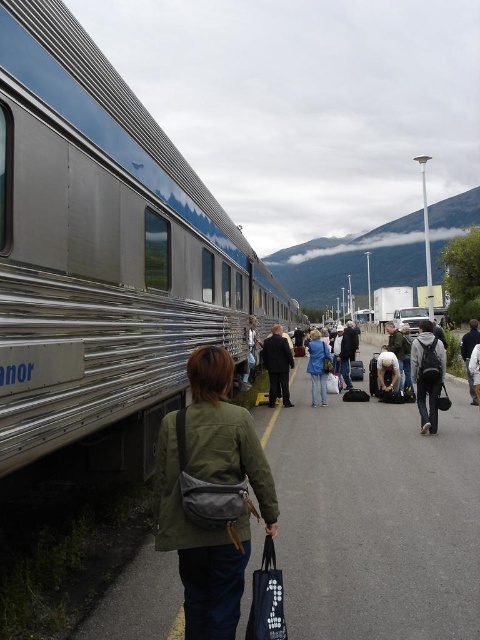
Question: Which point is closer to the camera?

Choices:
 (A) (224, 356)
 (B) (314, 346)
 (C) (192, 339)

Answer: (A)

Question: Which of these objects is positioned farthest from the silver polished metal train at left?

Choices:
 (A) dark gray suit at center
 (B) blue denim jeans at center
 (C) black fabric bag at lower center

Answer: (C)

Question: Can you confirm if black fabric bag at lower center is wider than dark gray backpack at center?

Choices:
 (A) yes
 (B) no

Answer: (B)

Question: Can you confirm if blue denim jeans at center is positioned to the right of dark gray jacket at right?

Choices:
 (A) yes
 (B) no

Answer: (B)

Question: Which point is farther to the camera?

Choices:
 (A) green fabric bag at lower center
 (B) dark gray suit at center
 (C) black fabric bag at lower center

Answer: (B)

Question: Is dark gray backpack at center below blue denim jeans at center?

Choices:
 (A) no
 (B) yes

Answer: (A)